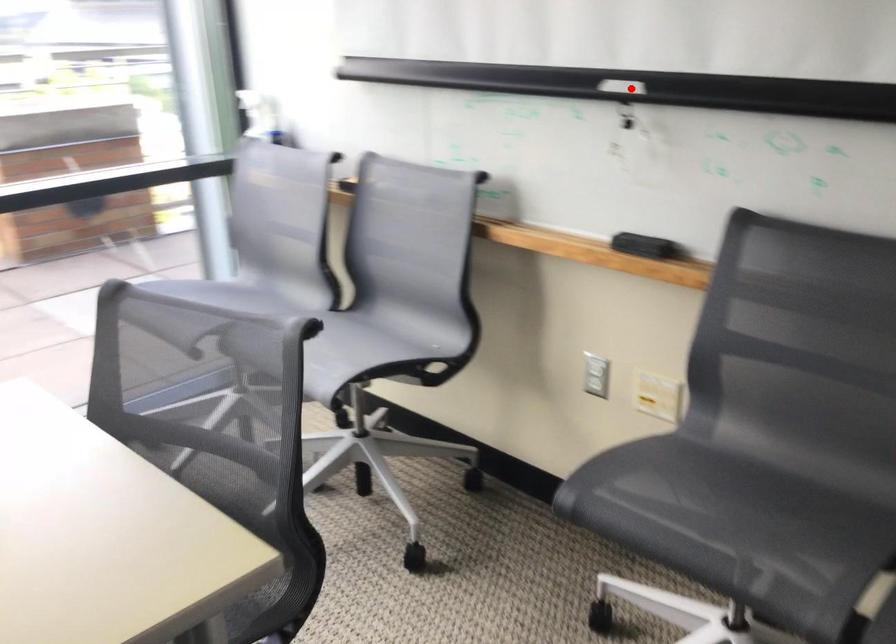
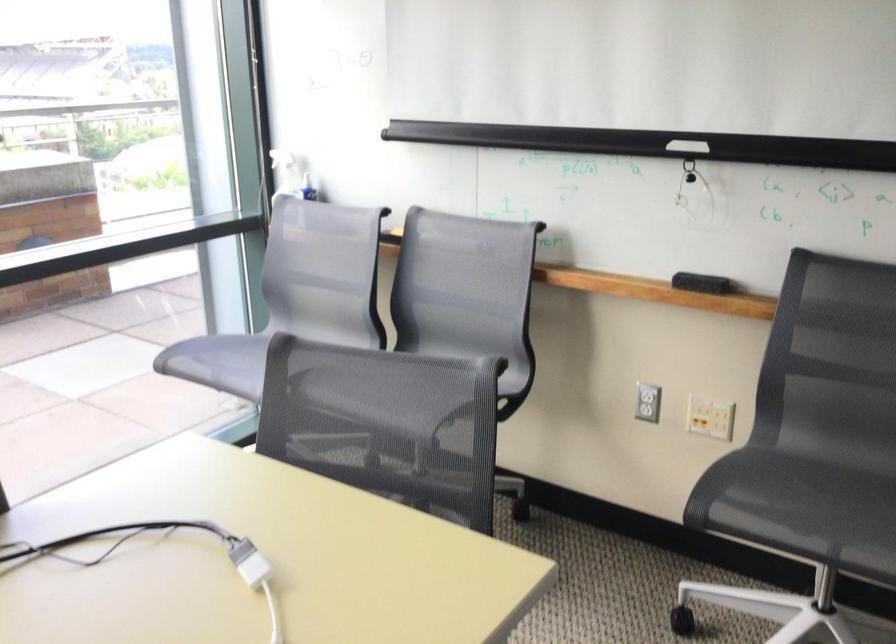
Question: I am providing you with two images of the same scene from different viewpoints. Given a red point in image1, look at the same physical point in image2. Is it:

Choices:
 (A) Closer to the viewpoint
 (B) Farther from the viewpoint

Answer: (B)